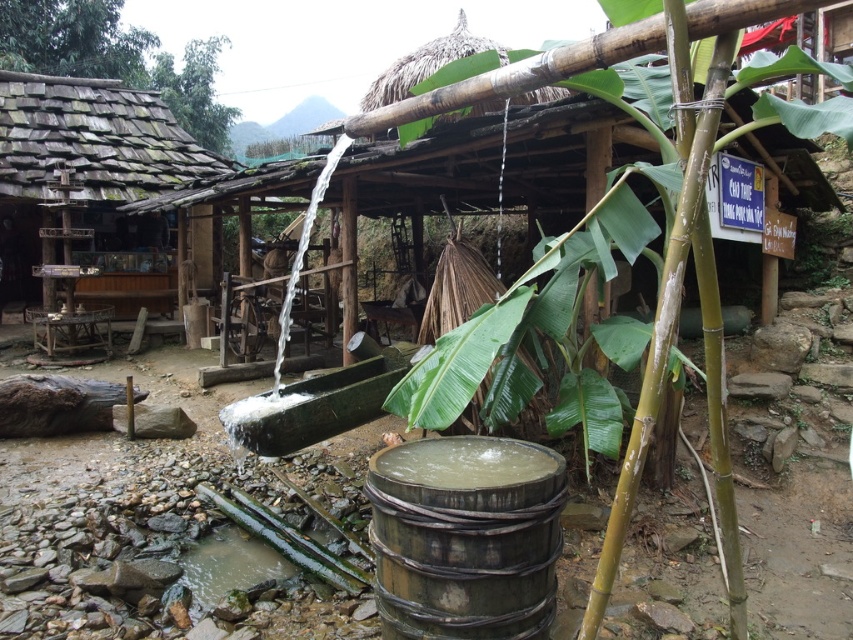
Question: From the image, what is the correct spatial relationship of green bamboo at center in relation to wooden shingles hut at left?

Choices:
 (A) left
 (B) right

Answer: (B)

Question: Which point appears closest to the camera in this image?

Choices:
 (A) (465, 561)
 (B) (158, 131)

Answer: (A)

Question: Which point is farther from the camera taking this photo?

Choices:
 (A) (595, 630)
 (B) (534, 614)

Answer: (B)

Question: Is green bamboo at center above wooden shingles hut at left?

Choices:
 (A) yes
 (B) no

Answer: (B)

Question: Is wooden barrel at center wider than wooden shingles hut at left?

Choices:
 (A) no
 (B) yes

Answer: (A)

Question: Which point is closer to the camera taking this photo?

Choices:
 (A) (453, 566)
 (B) (718, 513)

Answer: (A)